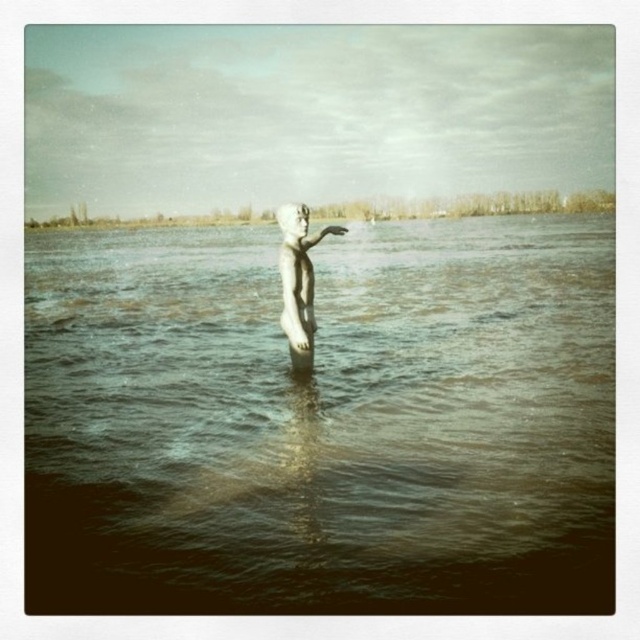
You are standing at the edge of the water and want to place a small decorative rock on the metallic water at center. Based on the coordinates provided, can you determine if the rock will be placed directly in the center of the water?

The metallic water at center is located at point (323,419), so placing the rock at these coordinates would position it directly in the center of the water.

In the scene shown: You are standing in front of the statue and want to place a small flower pot between the metallic water at center and the white stone statue at center. Which object should the flower pot be placed closer to?

The flower pot should be placed closer to the white stone statue at center because the metallic water at center is closer to the viewer, so placing it between them would require positioning it near the statue to maintain the spatial relationship.